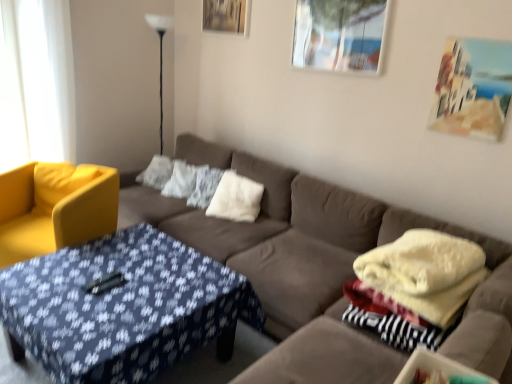
The image size is (512, 384). In order to click on white fluffy pillow at center, the second pillow when ordered from left to right in this screenshot , I will do `click(183, 180)`.

This screenshot has width=512, height=384. What do you see at coordinates (236, 198) in the screenshot?
I see `white fluffy pillow at center, the third pillow in the left-to-right sequence` at bounding box center [236, 198].

The width and height of the screenshot is (512, 384). Identify the location of white fluffy pillow at center, the third pillow in the left-to-right sequence. (236, 198).

Identify the location of soft cream blanket at right. This screenshot has width=512, height=384. (424, 274).

Locate an element on the screen. This screenshot has width=512, height=384. white fluffy pillow at center, the second pillow when ordered from left to right is located at coordinates (183, 180).

From the image's perspective, which one is positioned lower, painted canvas at upper right, which is the first picture frame from bottom to top, or soft cream blanket at right?

soft cream blanket at right.

Are painted canvas at upper right, arranged as the third picture frame when viewed from the back, and soft cream blanket at right beside each other?

There is a gap between painted canvas at upper right, arranged as the third picture frame when viewed from the back, and soft cream blanket at right.

Which is correct: painted canvas at upper right, the third picture frame in the left-to-right sequence, is inside soft cream blanket at right, or outside of it?

painted canvas at upper right, the third picture frame in the left-to-right sequence, exists outside the volume of soft cream blanket at right.

Does painted canvas at upper right, which ranks as the third picture frame in top-to-bottom order, appear on the right side of soft cream blanket at right?

Yes, painted canvas at upper right, which ranks as the third picture frame in top-to-bottom order, is to the right of soft cream blanket at right.

Which is less distant, (221, 288) or (18, 246)?

The point (221, 288) is closer to the camera.

Considering the relative sizes of blue fabric-covered coffee table at center and matte yellow armchair at left in the image provided, is blue fabric-covered coffee table at center wider than matte yellow armchair at left?

Yes.

Looking at the image, does blue fabric-covered coffee table at center seem bigger or smaller compared to matte yellow armchair at left?

In the image, blue fabric-covered coffee table at center appears to be smaller than matte yellow armchair at left.

Can you tell me how much soft cream blanket at right and white fluffy pillow at center, the second pillow when ordered from left to right, differ in facing direction?

They differ by 18 degrees in their facing directions.

Which is behind, soft cream blanket at right or white fluffy pillow at center, the second pillow when ordered from left to right?

white fluffy pillow at center, the second pillow when ordered from left to right, is further away from the camera.

Considering the positions of objects soft cream blanket at right and white fluffy pillow at center, which is the second pillow from right to left, in the image provided, who is more to the right, soft cream blanket at right or white fluffy pillow at center, which is the second pillow from right to left,?

From the viewer's perspective, soft cream blanket at right appears more on the right side.

Locate an element on the screen. This screenshot has width=512, height=384. blanket in front of the white fluffy pillow at center, the second pillow when ordered from left to right is located at coordinates (424, 274).

Is wooden picture frame at upper center, positioned as the first picture frame in top-to-bottom order, placed right next to white fluffy pillow at center, which is the second pillow from right to left?

No, wooden picture frame at upper center, positioned as the first picture frame in top-to-bottom order, is not with white fluffy pillow at center, which is the second pillow from right to left.

Considering the sizes of objects wooden picture frame at upper center, positioned as the first picture frame in top-to-bottom order, and white fluffy pillow at center, which is the second pillow from right to left, in the image provided, who is smaller, wooden picture frame at upper center, positioned as the first picture frame in top-to-bottom order, or white fluffy pillow at center, which is the second pillow from right to left,?

Answer: wooden picture frame at upper center, positioned as the first picture frame in top-to-bottom order.

Which of these two, wooden picture frame at upper center, positioned as the third picture frame in bottom-to-top order, or white fluffy pillow at center, the second pillow when ordered from left to right, stands taller?

white fluffy pillow at center, the second pillow when ordered from left to right, is taller.

Can you tell me how much wooden picture frame at upper center, which is the first picture frame in left-to-right order, and white fluffy pillow at center, which is the second pillow from right to left, differ in facing direction?

The angular difference between wooden picture frame at upper center, which is the first picture frame in left-to-right order, and white fluffy pillow at center, which is the second pillow from right to left, is 20.6 degrees.

Considering the relative positions of matte yellow armchair at left and matte brown couch at center in the image provided, is matte yellow armchair at left to the right of matte brown couch at center from the viewer's perspective?

Incorrect, matte yellow armchair at left is not on the right side of matte brown couch at center.

Does point (72, 193) lie in front of point (367, 231)?

No.

Which object is closer to the camera taking this photo, matte yellow armchair at left or matte brown couch at center?

matte brown couch at center.

Is matte yellow armchair at left located outside matte brown couch at center?

Actually, matte yellow armchair at left is at least partially inside matte brown couch at center.

Is matte yellow armchair at left facing away from white fluffy pillow at center, which is the second pillow from right to left?

No, white fluffy pillow at center, which is the second pillow from right to left, is not at the back of matte yellow armchair at left.

Which is more to the left, matte yellow armchair at left or white fluffy pillow at center, the second pillow when ordered from left to right?

From the viewer's perspective, matte yellow armchair at left appears more on the left side.

Does matte yellow armchair at left contain white fluffy pillow at center, the second pillow when ordered from left to right?

Definitely not — white fluffy pillow at center, the second pillow when ordered from left to right, is not inside matte yellow armchair at left.

Considering the points (157, 156) and (234, 174), which point is behind, point (157, 156) or point (234, 174)?

Point (157, 156)

From the white fluffy pillow at center, the first pillow when ordered from left to right, count 2nd pillows forward and point to it. Please provide its 2D coordinates.

[(236, 198)]

Consider the image. Which of these two, white fluffy pillow at center, the first pillow when ordered from left to right, or white fluffy pillow at center, the 1th pillow viewed from the right, is bigger?

Bigger between the two is white fluffy pillow at center, the 1th pillow viewed from the right.

This screenshot has height=384, width=512. What are the coordinates of `picture frame that is on the right side of soft cream blanket at right` in the screenshot? It's located at (473, 88).

Locate an element on the screen. The image size is (512, 384). coffee table that is in front of the matte yellow armchair at left is located at coordinates (122, 306).

Based on the photo, based on their spatial positions, is white fluffy pillow at center, which is the second pillow from right to left, or matte yellow armchair at left further from matte brown couch at center?

matte yellow armchair at left lies further to matte brown couch at center than the other object.

Estimate the real-world distances between objects in this image. Which object is closer to matte brown couch at center, soft cream blanket at right or white fluffy pillow at center, the 1th pillow viewed from the right?

soft cream blanket at right is closer to matte brown couch at center.

Based on their spatial positions, is painted canvas at upper right, acting as the 1th picture frame starting from the right, or blue fabric-covered coffee table at center closer to white fluffy pillow at center, which is the second pillow from right to left?

The object closer to white fluffy pillow at center, which is the second pillow from right to left, is blue fabric-covered coffee table at center.

Estimate the real-world distances between objects in this image. Which object is closer to black glass floor lamp at upper left, matte yellow armchair at left or matte brown couch at center?

The object closer to black glass floor lamp at upper left is matte yellow armchair at left.

Which object lies further to the anchor point metallic glass picture frame at upper right, positioned as the second picture frame in bottom-to-top order, matte yellow armchair at left or soft cream blanket at right?

The object further to metallic glass picture frame at upper right, positioned as the second picture frame in bottom-to-top order, is matte yellow armchair at left.

Looking at the image, which one is located further to white fluffy pillow at center, the first pillow when ordered from left to right, matte yellow armchair at left or black glass floor lamp at upper left?

Based on the image, black glass floor lamp at upper left appears to be further to white fluffy pillow at center, the first pillow when ordered from left to right.

Consider the image. From the image, which object appears to be nearer to matte brown couch at center, metallic glass picture frame at upper right, positioned as the second picture frame in bottom-to-top order, or white fluffy pillow at center, the 1th pillow viewed from the right?

white fluffy pillow at center, the 1th pillow viewed from the right, is positioned closer to the anchor matte brown couch at center.

From the picture: Estimate the real-world distances between objects in this image. Which object is closer to matte yellow armchair at left, white fluffy pillow at center, the first pillow when ordered from left to right, or painted canvas at upper right, acting as the 1th picture frame starting from the right?

white fluffy pillow at center, the first pillow when ordered from left to right, lies closer to matte yellow armchair at left than the other object.

Find the location of a particular element. This screenshot has height=384, width=512. pillow between wooden picture frame at upper center, positioned as the 3th picture frame in front-to-back order, and painted canvas at upper right, which is the first picture frame from bottom to top, from left to right is located at coordinates (236, 198).

Where is `blanket positioned between matte brown couch at center and white fluffy pillow at center, the first pillow when ordered from left to right, from near to far`? blanket positioned between matte brown couch at center and white fluffy pillow at center, the first pillow when ordered from left to right, from near to far is located at coordinates (424, 274).

Locate an element on the screen. blanket between wooden picture frame at upper center, positioned as the third picture frame in bottom-to-top order, and blue fabric-covered coffee table at center vertically is located at coordinates (424, 274).

You are a GUI agent. You are given a task and a screenshot of the screen. Output one action in this format:
    pyautogui.click(x=<x>, y=<y>)
    Task: Click on the coffee table positioned between matte brown couch at center and wooden picture frame at upper center, positioned as the first picture frame in top-to-bottom order, from near to far
    
    Given the screenshot: What is the action you would take?
    pyautogui.click(x=122, y=306)